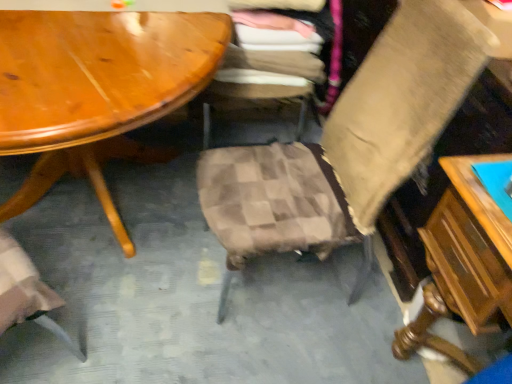
Question: Is wooden table at right not close to plaid fabric chair at center, which is the second chair from right to left?

Choices:
 (A) no
 (B) yes

Answer: (A)

Question: Is wooden table at right wider than plaid fabric chair at center, which is the second chair from right to left?

Choices:
 (A) no
 (B) yes

Answer: (A)

Question: Is wooden table at right thinner than plaid fabric chair at center, which is the second chair from right to left?

Choices:
 (A) yes
 (B) no

Answer: (A)

Question: Is wooden table at right positioned in front of plaid fabric chair at center, which is the second chair from right to left?

Choices:
 (A) no
 (B) yes

Answer: (B)

Question: Can plaid fabric chair at center, which is counted as the first chair, starting from the left, be found inside wooden table at right?

Choices:
 (A) no
 (B) yes

Answer: (A)

Question: Relative to wooden table at right, is plaid fabric chair at center, which is the second chair from right to left, in front or behind?

Choices:
 (A) front
 (B) behind

Answer: (B)

Question: From the image's perspective, is plaid fabric chair at center, which is the second chair from right to left, located above or below wooden table at right?

Choices:
 (A) below
 (B) above

Answer: (B)

Question: From their relative heights in the image, would you say plaid fabric chair at center, which is counted as the first chair, starting from the left, is taller or shorter than wooden table at right?

Choices:
 (A) tall
 (B) short

Answer: (A)

Question: Based on their positions, is plaid fabric chair at center, which is counted as the first chair, starting from the left, located to the left or right of wooden table at right?

Choices:
 (A) right
 (B) left

Answer: (B)

Question: Is wooden table at right in front of or behind plaid fabric chair at center, which is the second chair from right to left, in the image?

Choices:
 (A) front
 (B) behind

Answer: (A)

Question: Do you think wooden table at right is within plaid fabric chair at center, which is counted as the first chair, starting from the left, or outside of it?

Choices:
 (A) outside
 (B) inside

Answer: (A)

Question: Would you say wooden table at right is to the left or to the right of plaid fabric chair at center, which is the second chair from right to left, in the picture?

Choices:
 (A) left
 (B) right

Answer: (B)

Question: From the image's perspective, relative to plaid fabric chair at center, which is the second chair from right to left, is wooden table at right above or below?

Choices:
 (A) below
 (B) above

Answer: (A)

Question: Does point (286, 152) appear closer or farther from the camera than point (431, 306)?

Choices:
 (A) closer
 (B) farther

Answer: (B)

Question: Considering their positions, is beige fabric chair at center, the first chair viewed from the right, located in front of or behind wooden table at right?

Choices:
 (A) behind
 (B) front

Answer: (A)